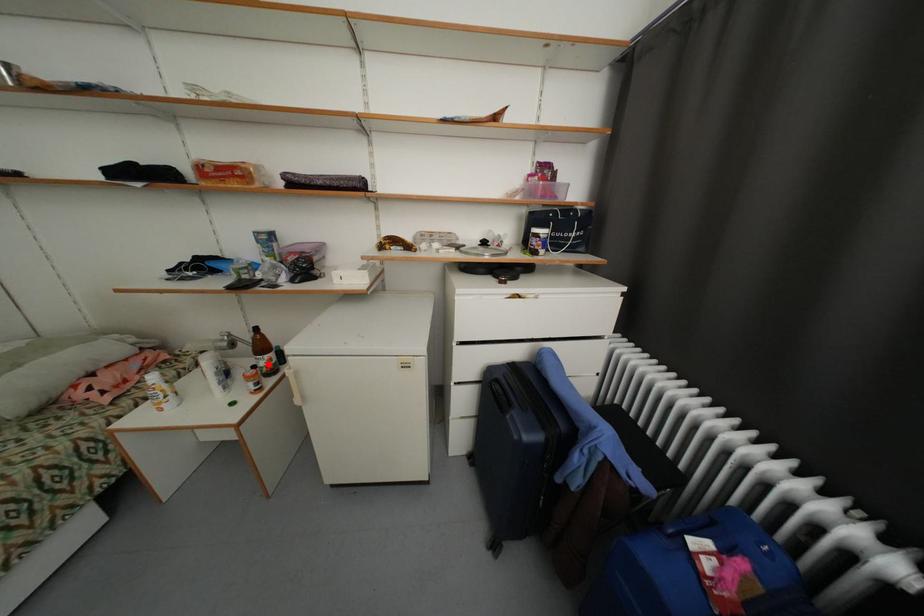
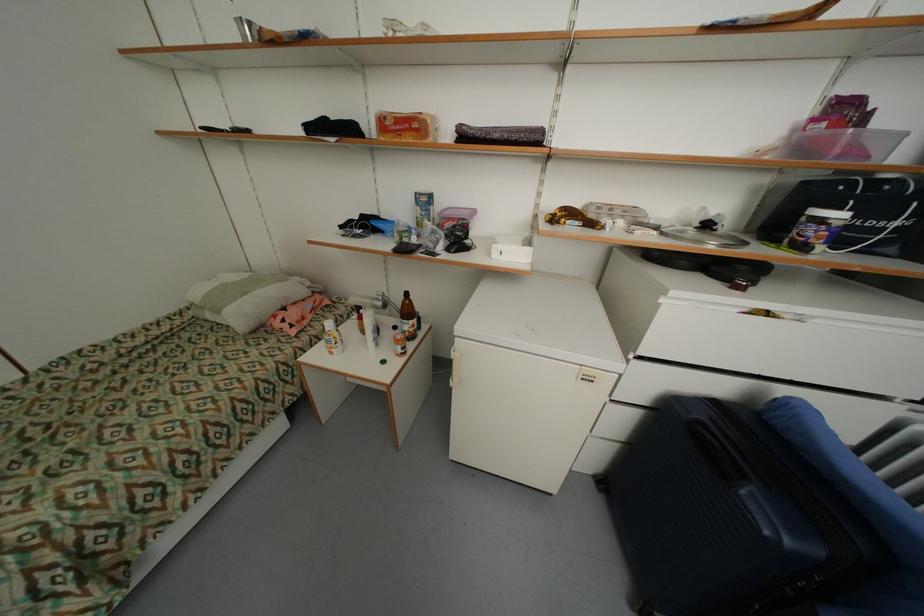
Question: I am providing you with two images of the same scene from different viewpoints. Given a red point in image1, look at the same physical point in image2. Is it:

Choices:
 (A) Closer to the viewpoint
 (B) Farther from the viewpoint

Answer: (A)